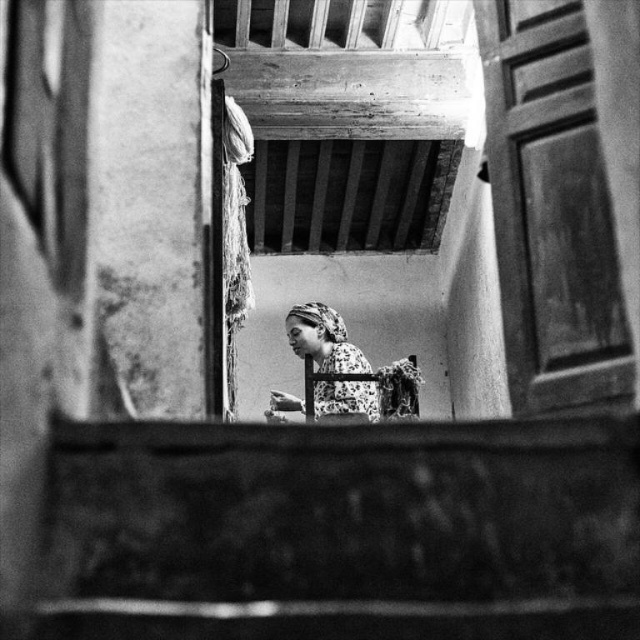
Question: Among these points, which one is farthest from the camera?

Choices:
 (A) (362, 392)
 (B) (156, 422)

Answer: (A)

Question: Can you confirm if smooth concrete stairs at lower center is positioned to the left of floral fabric headscarf at center?

Choices:
 (A) yes
 (B) no

Answer: (B)

Question: In this image, where is smooth concrete stairs at lower center located relative to floral fabric headscarf at center?

Choices:
 (A) right
 (B) left

Answer: (A)

Question: Can you confirm if smooth concrete stairs at lower center is positioned to the left of floral fabric headscarf at center?

Choices:
 (A) yes
 (B) no

Answer: (B)